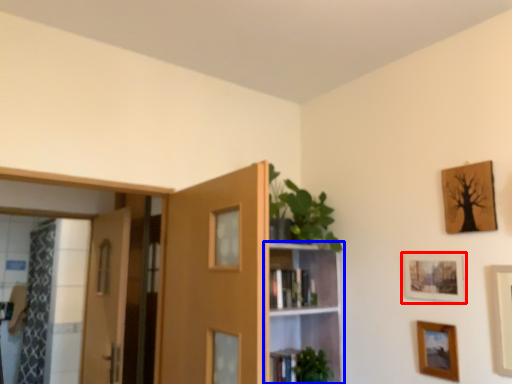
Question: Which point is closer to the camera, picture frame (highlighted by a red box) or shelf (highlighted by a blue box)?

Choices:
 (A) picture frame
 (B) shelf

Answer: (A)